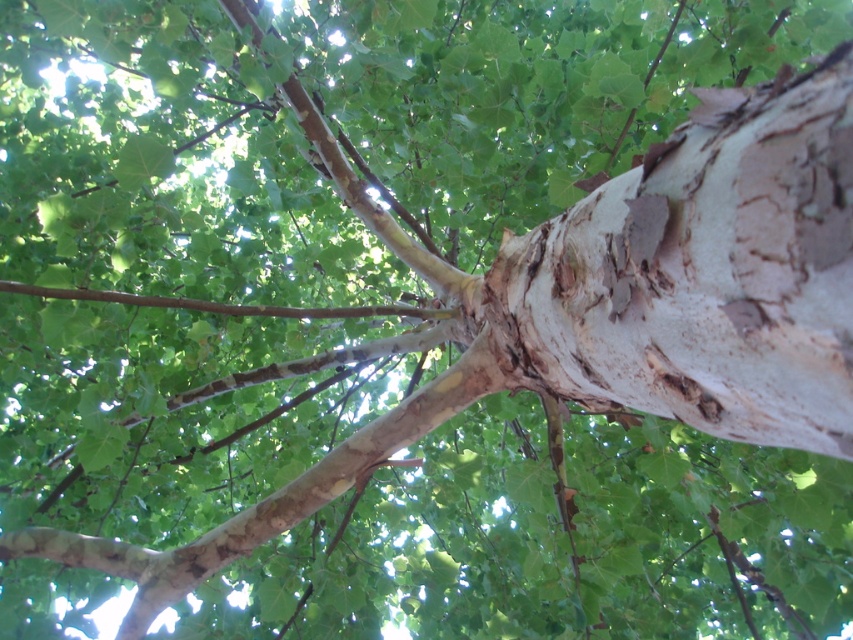
Does white rough bark at center appear on the right side of brown rough branch at center?

Yes, white rough bark at center is to the right of brown rough branch at center.

Between point (746, 369) and point (200, 300), which one is positioned in front?

Point (746, 369) is more forward.

I want to click on white rough bark at center, so click(704, 273).